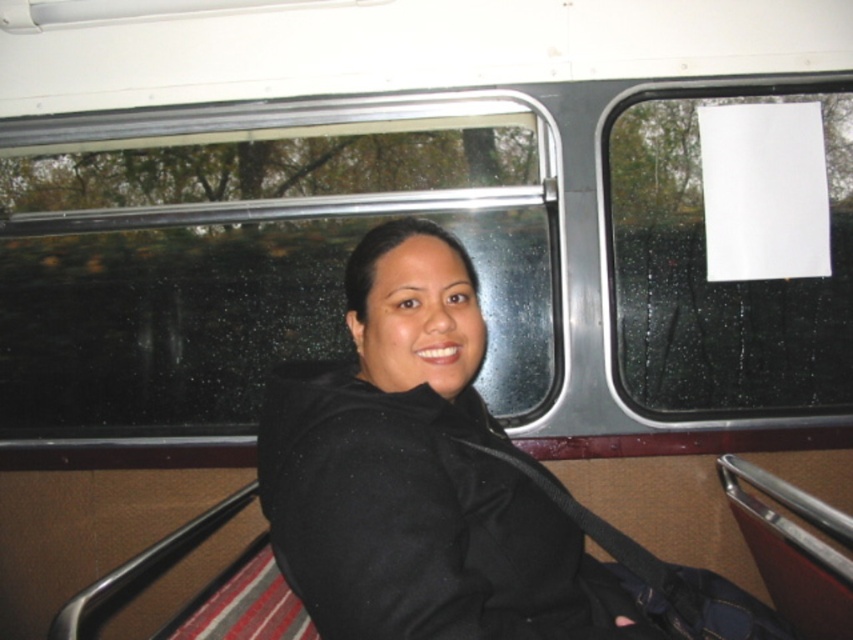
Is point (314, 184) closer to viewer compared to point (383, 346)?

No, (314, 184) is further to viewer.

Which is in front, point (67, 380) or point (329, 440)?

Point (329, 440) is more forward.

The height and width of the screenshot is (640, 853). Describe the element at coordinates (251, 260) in the screenshot. I see `transparent glass window at upper center` at that location.

Locate an element on the screen. transparent glass window at upper center is located at coordinates (251, 260).

Identify the location of black matte jacket at center. The image size is (853, 640). click(x=418, y=474).

Who is positioned more to the right, black matte jacket at center or white paper at upper right?

From the viewer's perspective, white paper at upper right appears more on the right side.

Which is in front, point (300, 387) or point (639, 376)?

Positioned in front is point (300, 387).

The image size is (853, 640). Identify the location of black matte jacket at center. (418, 474).

Is transparent glass window at upper center closer to camera compared to white paper at upper right?

No, transparent glass window at upper center is behind white paper at upper right.

Is transparent glass window at upper center above white paper at upper right?

Actually, transparent glass window at upper center is below white paper at upper right.

The height and width of the screenshot is (640, 853). I want to click on transparent glass window at upper center, so click(251, 260).

You are a GUI agent. You are given a task and a screenshot of the screen. Output one action in this format:
    pyautogui.click(x=<x>, y=<y>)
    Task: Click on the transparent glass window at upper center
    The width and height of the screenshot is (853, 640).
    Given the screenshot: What is the action you would take?
    pyautogui.click(x=251, y=260)